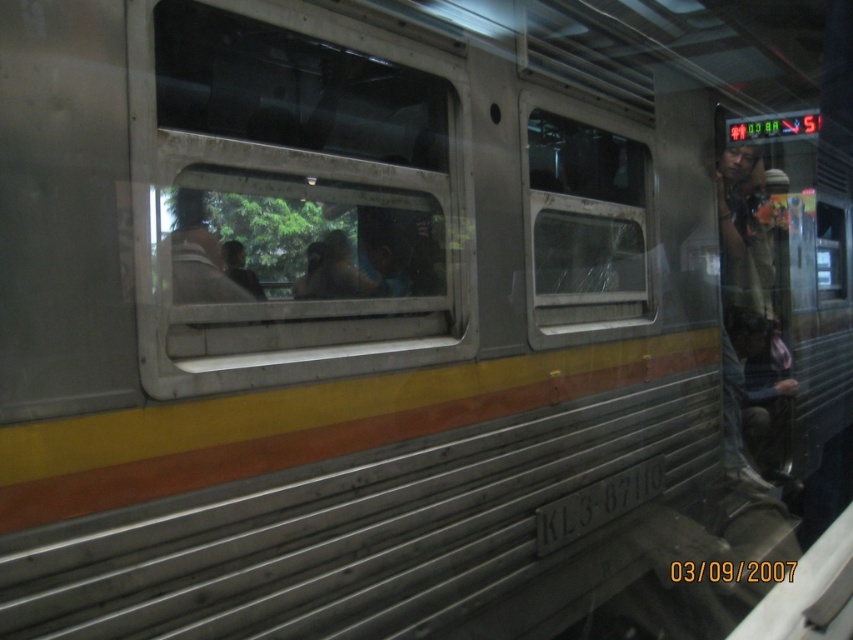
Can you confirm if clear glass window at center is smaller than matte brown jacket at center?

No, clear glass window at center is not smaller than matte brown jacket at center.

Does clear glass window at center appear over matte brown jacket at center?

Indeed, clear glass window at center is positioned over matte brown jacket at center.

Who is more distant from viewer, (323,99) or (178,204)?

Positioned behind is point (323,99).

Where is `clear glass window at center`? clear glass window at center is located at coordinates (292, 196).

Is clear glass window at center below transparent glass window at center?

Yes.

Is the position of clear glass window at center less distant than that of transparent glass window at center?

Yes.

You are a GUI agent. You are given a task and a screenshot of the screen. Output one action in this format:
    pyautogui.click(x=<x>, y=<y>)
    Task: Click on the clear glass window at center
    The width and height of the screenshot is (853, 640).
    Given the screenshot: What is the action you would take?
    pyautogui.click(x=292, y=196)

Can you confirm if transparent glass window at center is smaller than matte brown jacket at center?

No.

Is transparent glass window at center thinner than matte brown jacket at center?

In fact, transparent glass window at center might be wider than matte brown jacket at center.

Which is in front, point (613, 259) or point (173, 257)?

Point (173, 257)

Where is `transparent glass window at center`? Image resolution: width=853 pixels, height=640 pixels. transparent glass window at center is located at coordinates (584, 220).